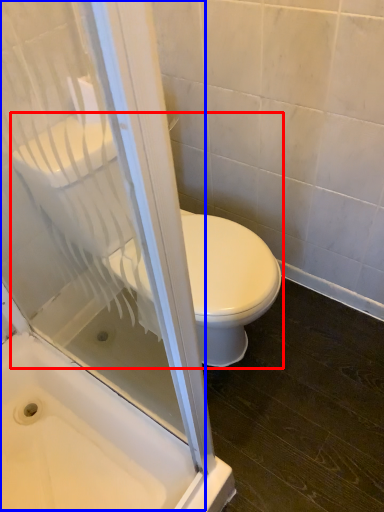
Question: Which of the following is the farthest to the observer, toilet (highlighted by a red box) or screen door (highlighted by a blue box)?

Choices:
 (A) toilet
 (B) screen door

Answer: (A)